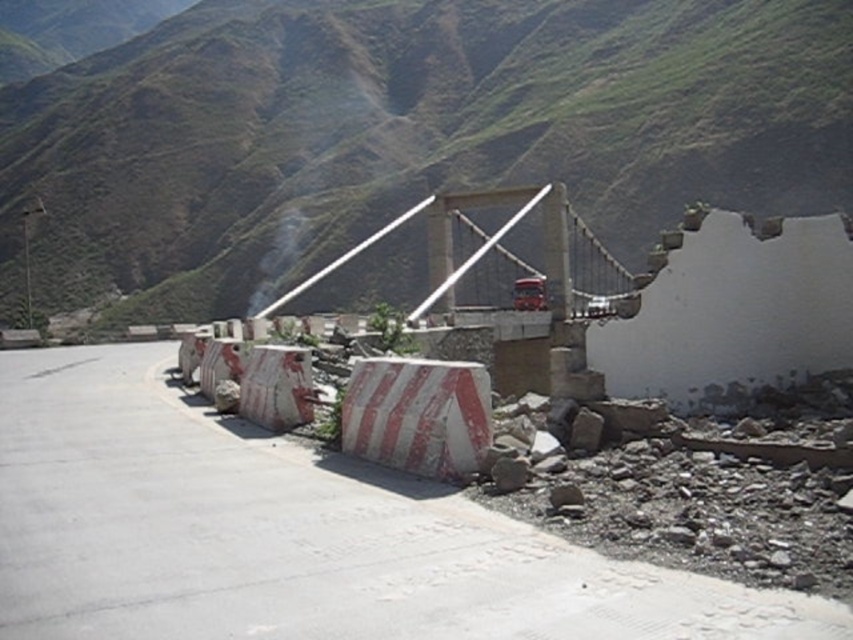
Which of these two, white concrete barrier at center or gray rough rock at lower right, stands taller?

white concrete barrier at center is taller.

Between white concrete barrier at center and gray rough rock at lower right, which one is positioned lower?

white concrete barrier at center

Is point (91, 538) positioned behind point (566, 490)?

No, (91, 538) is in front of (566, 490).

Locate an element on the screen. white concrete barrier at center is located at coordinates (292, 534).

Does white concrete barrier at center appear on the left side of gray rough rock at lower center?

Indeed, white concrete barrier at center is positioned on the left side of gray rough rock at lower center.

Can you confirm if white concrete barrier at center is shorter than gray rough rock at lower center?

No, white concrete barrier at center is not shorter than gray rough rock at lower center.

At what (x,y) coordinates should I click in order to perform the action: click on white concrete barrier at center. Please return your answer as a coordinate pair (x, y). This screenshot has width=853, height=640. Looking at the image, I should click on (292, 534).

Between green grassy mountain at upper center and white concrete barrier at center, which one is positioned higher?

Positioned higher is green grassy mountain at upper center.

Based on the photo, who is taller, green grassy mountain at upper center or white concrete barrier at center?

green grassy mountain at upper center is taller.

Between point (750, 150) and point (114, 424), which one is positioned behind?

Positioned behind is point (750, 150).

Identify the location of green grassy mountain at upper center. The height and width of the screenshot is (640, 853). (405, 132).